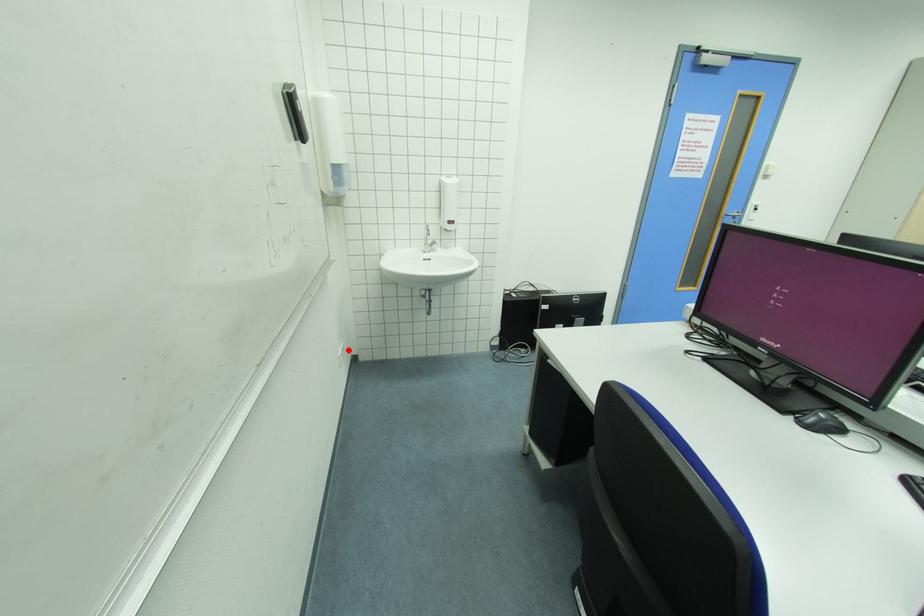
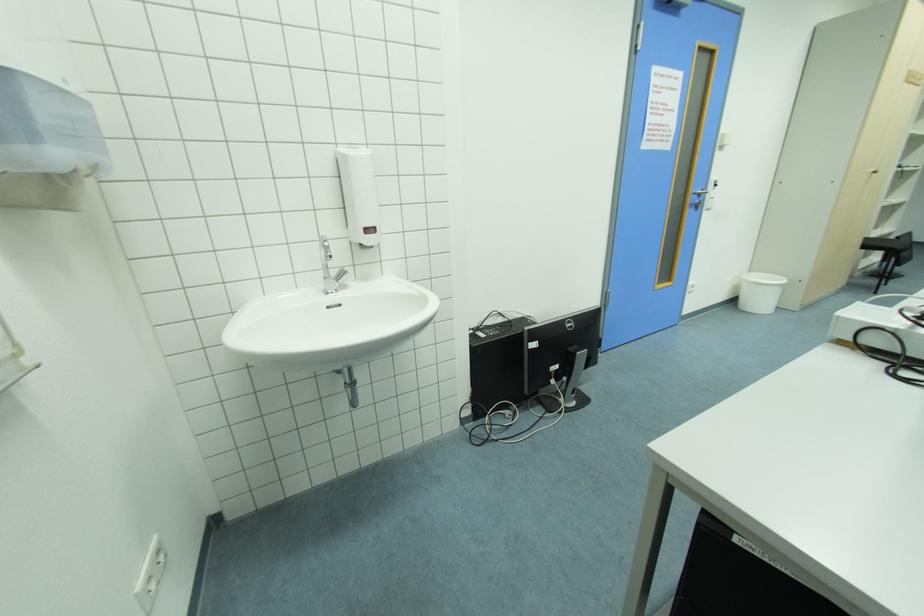
In the second image, find the point that corresponds to the highlighted location in the first image.

(164, 549)